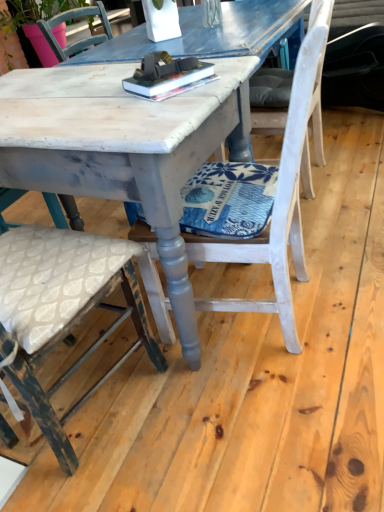
Image resolution: width=384 pixels, height=512 pixels. What are the coordinates of `distressed white wood table at center` in the screenshot? It's located at (119, 149).

Describe the element at coordinates (66, 306) in the screenshot. I see `distressed white chair at center, which ranks as the third chair in right-to-left order` at that location.

Where is `white painted wood chair at center, which appears as the second chair when viewed from the right`? This screenshot has height=512, width=384. white painted wood chair at center, which appears as the second chair when viewed from the right is located at coordinates (281, 192).

From the image's perspective, between white painted wood chair at center, which appears as the second chair when viewed from the right, and hardcover book at center, who is located below?

white painted wood chair at center, which appears as the second chair when viewed from the right.

Considering the points (222, 245) and (127, 91), which point is in front, point (222, 245) or point (127, 91)?

The point (222, 245) is closer to the camera.

What's the angular difference between white painted wood chair at center, arranged as the 2th chair when viewed from the left, and hardcover book at center's facing directions?

53.5 degrees.

Is white painted wood chair at center, arranged as the 2th chair when viewed from the left, positioned in front of hardcover book at center?

Yes, the depth of white painted wood chair at center, arranged as the 2th chair when viewed from the left, is less than that of hardcover book at center.

Between white painted wood chair at center, arranged as the third chair when viewed from the left, and matte pink pot at upper left, which one has smaller width?

white painted wood chair at center, arranged as the third chair when viewed from the left.

Which object is more forward, white painted wood chair at center, the 1th chair in the right-to-left sequence, or matte pink pot at upper left?

white painted wood chair at center, the 1th chair in the right-to-left sequence.

From the image's perspective, is white painted wood chair at center, the 1th chair in the right-to-left sequence, located above or below matte pink pot at upper left?

Clearly, from the image's perspective, white painted wood chair at center, the 1th chair in the right-to-left sequence, is below matte pink pot at upper left.

How many degrees apart are the facing directions of white painted wood chair at center, the 1th chair in the right-to-left sequence, and matte pink pot at upper left?

There is a 179-degree angle between the facing directions of white painted wood chair at center, the 1th chair in the right-to-left sequence, and matte pink pot at upper left.

Which of these two, distressed white wood table at center or hardcover book at center, is bigger?

distressed white wood table at center.

Image resolution: width=384 pixels, height=512 pixels. What are the coordinates of `book above the distressed white wood table at center (from a real-world perspective)` in the screenshot? It's located at (166, 75).

From a real-world perspective, is distressed white wood table at center physically below hardcover book at center?

Indeed, from a real-world perspective, distressed white wood table at center is positioned beneath hardcover book at center.

Considering the sizes of objects distressed white wood table at center and hardcover book at center in the image provided, who is thinner, distressed white wood table at center or hardcover book at center?

hardcover book at center is thinner.

Can you confirm if hardcover book at center is bigger than distressed white wood table at center?

No, hardcover book at center is not bigger than distressed white wood table at center.

Looking at this image, would you consider hardcover book at center to be distant from distressed white wood table at center?

No, there isn't a large distance between hardcover book at center and distressed white wood table at center.

Does hardcover book at center contain distressed white wood table at center?

No.

Identify the location of round table that appears below the hardcover book at center (from a real-world perspective). Image resolution: width=384 pixels, height=512 pixels. (119, 149).

Considering the relative sizes of white painted wood chair at center, arranged as the third chair when viewed from the left, and distressed white chair at center, the first chair from the left, in the image provided, is white painted wood chair at center, arranged as the third chair when viewed from the left, shorter than distressed white chair at center, the first chair from the left,?

No.

Can distressed white chair at center, which ranks as the third chair in right-to-left order, be found inside white painted wood chair at center, arranged as the third chair when viewed from the left?

That's incorrect, distressed white chair at center, which ranks as the third chair in right-to-left order, is not inside white painted wood chair at center, arranged as the third chair when viewed from the left.

Between point (302, 178) and point (56, 265), which one is positioned in front?

Point (56, 265)

Is white painted wood chair at center, arranged as the third chair when viewed from the left, to the right of distressed white chair at center, the first chair from the left, from the viewer's perspective?

Yes, white painted wood chair at center, arranged as the third chair when viewed from the left, is to the right of distressed white chair at center, the first chair from the left.

From a real-world perspective, is distressed white wood table at center above or below matte pink pot at upper left?

From a real-world perspective, distressed white wood table at center is physically below matte pink pot at upper left.

In the scene shown: Measure the distance from distressed white wood table at center to matte pink pot at upper left.

The distance of distressed white wood table at center from matte pink pot at upper left is 35.41 inches.

Can you confirm if distressed white wood table at center is wider than matte pink pot at upper left?

Yes, distressed white wood table at center is wider than matte pink pot at upper left.

Is distressed white wood table at center closer to the viewer compared to matte pink pot at upper left?

Yes, it is in front of matte pink pot at upper left.

Can you see distressed white wood table at center touching white painted wood chair at center, arranged as the 2th chair when viewed from the left?

There is a gap between distressed white wood table at center and white painted wood chair at center, arranged as the 2th chair when viewed from the left.

From a real-world perspective, which object stands above the other?

white painted wood chair at center, which appears as the second chair when viewed from the right.

Would you say distressed white wood table at center contains white painted wood chair at center, arranged as the 2th chair when viewed from the left?

Yes, distressed white wood table at center contains white painted wood chair at center, arranged as the 2th chair when viewed from the left.

Where is `book that appears behind the white painted wood chair at center, which appears as the second chair when viewed from the right`? This screenshot has height=512, width=384. book that appears behind the white painted wood chair at center, which appears as the second chair when viewed from the right is located at coordinates pos(166,75).

Image resolution: width=384 pixels, height=512 pixels. I want to click on plant above the white painted wood chair at center, arranged as the third chair when viewed from the left (from a real-world perspective), so click(32, 12).

From the image, which object appears to be nearer to white painted wood chair at center, arranged as the 2th chair when viewed from the left, matte pink pot at upper left or hardcover book at center?

Among the two, hardcover book at center is located nearer to white painted wood chair at center, arranged as the 2th chair when viewed from the left.

Based on their spatial positions, is hardcover book at center or distressed white wood table at center closer to white painted wood chair at center, the 1th chair in the right-to-left sequence?

Based on the image, hardcover book at center appears to be nearer to white painted wood chair at center, the 1th chair in the right-to-left sequence.

When comparing their distances from white painted wood chair at center, the 1th chair in the right-to-left sequence, does distressed white wood table at center or distressed white chair at center, the first chair from the left, seem closer?

Based on the image, distressed white wood table at center appears to be nearer to white painted wood chair at center, the 1th chair in the right-to-left sequence.

Considering their positions, is distressed white chair at center, which ranks as the third chair in right-to-left order, positioned closer to distressed white wood table at center than white painted wood chair at center, arranged as the third chair when viewed from the left?

Based on the image, distressed white chair at center, which ranks as the third chair in right-to-left order, appears to be nearer to distressed white wood table at center.

From the image, which object appears to be nearer to matte pink pot at upper left, white painted wood chair at center, which appears as the second chair when viewed from the right, or distressed white wood table at center?

Based on the image, distressed white wood table at center appears to be nearer to matte pink pot at upper left.

Which object lies further to the anchor point distressed white wood table at center, matte pink pot at upper left or distressed white chair at center, the first chair from the left?

Based on the image, matte pink pot at upper left appears to be further to distressed white wood table at center.

When comparing their distances from distressed white chair at center, the first chair from the left, does hardcover book at center or white painted wood chair at center, arranged as the third chair when viewed from the left, seem closer?

hardcover book at center.

Looking at the image, which one is located further to distressed white chair at center, which ranks as the third chair in right-to-left order, matte pink pot at upper left or white painted wood chair at center, the 1th chair in the right-to-left sequence?

Among the two, matte pink pot at upper left is located further to distressed white chair at center, which ranks as the third chair in right-to-left order.

The width and height of the screenshot is (384, 512). Identify the location of round table between distressed white chair at center, which ranks as the third chair in right-to-left order, and white painted wood chair at center, arranged as the third chair when viewed from the left, from front to back. (119, 149).

Locate an element on the screen. round table between distressed white chair at center, which ranks as the third chair in right-to-left order, and white painted wood chair at center, arranged as the 2th chair when viewed from the left, from left to right is located at coordinates (119, 149).

Find the location of `chair between white painted wood chair at center, which appears as the second chair when viewed from the right, and matte pink pot at upper left in the front-back direction`. chair between white painted wood chair at center, which appears as the second chair when viewed from the right, and matte pink pot at upper left in the front-back direction is located at coordinates pos(319,73).

Find the location of a particular element. chair between distressed white wood table at center and matte pink pot at upper left along the z-axis is located at coordinates pyautogui.click(x=319, y=73).